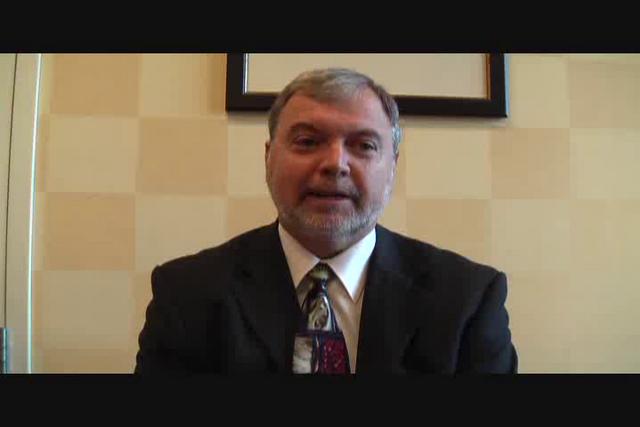
This screenshot has height=427, width=640. Identify the location of wall. (x=541, y=260).